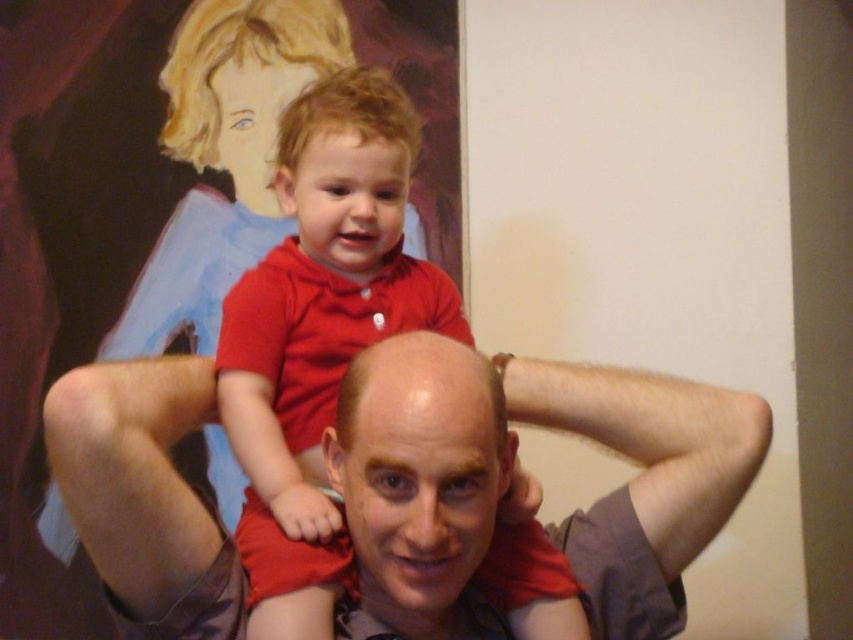
You are a photographer adjusting your camera to focus on the matte red shirt at center. Since you can only focus on one object at a time, will you need to adjust the focus if you want to also include the smooth gray shirt at center in the shot?

The smooth gray shirt at center is closer to the viewer than matte red shirt at center. Therefore, if you focus on the matte red shirt at center, you will need to adjust the focus to include the smooth gray shirt at center since it is at a different distance.

You are a photographer setting up for a family photo. You need to ensure that the smooth gray shirt at center and the red matte shirt at upper center are both visible in the frame. Based on their positions, which shirt should you focus on first to ensure both are in focus?

The smooth gray shirt at center is not as tall as the red matte shirt at upper center, so you should focus on the red matte shirt at upper center first since it is taller and might require adjusting the focus to capture both shirts clearly.

You are a photographer setting up a shoot in this scene. You need to ensure that the red matte shirt at upper center and the matte red shirt at center are both visible in the frame. Given their sizes, which one should you focus on to ensure both are in the shot without cropping?

The red matte shirt at upper center is taller than the matte red shirt at center. To ensure both are visible, focus on framing the taller red matte shirt at upper center first, as it requires more space, and the smaller one will naturally fit into the frame.